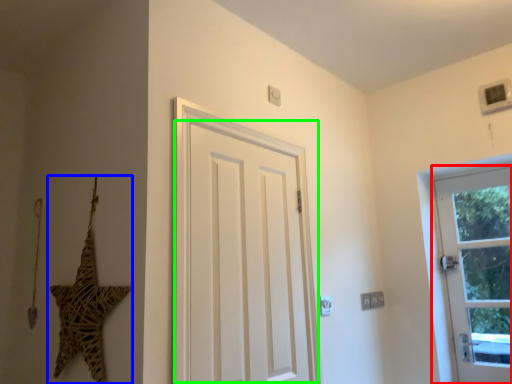
Question: Which object is the farthest from door (highlighted by a red box)? Choose among these: star (highlighted by a blue box) or door (highlighted by a green box).

Choices:
 (A) star
 (B) door

Answer: (A)